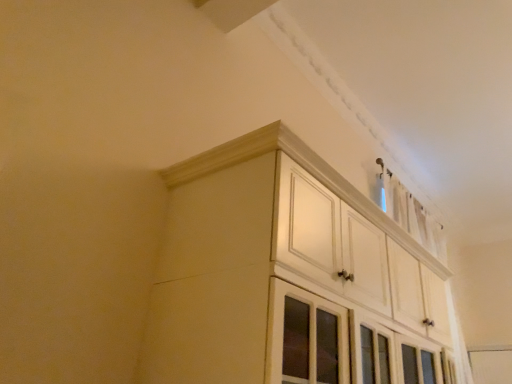
The image size is (512, 384). What do you see at coordinates (289, 277) in the screenshot?
I see `white glossy cabinet at upper center` at bounding box center [289, 277].

At what (x,y) coordinates should I click in order to perform the action: click on white glossy cabinet at upper center. Please return your answer as a coordinate pair (x, y). This screenshot has width=512, height=384. Looking at the image, I should click on (289, 277).

I want to click on white glossy cabinet at upper center, so point(289,277).